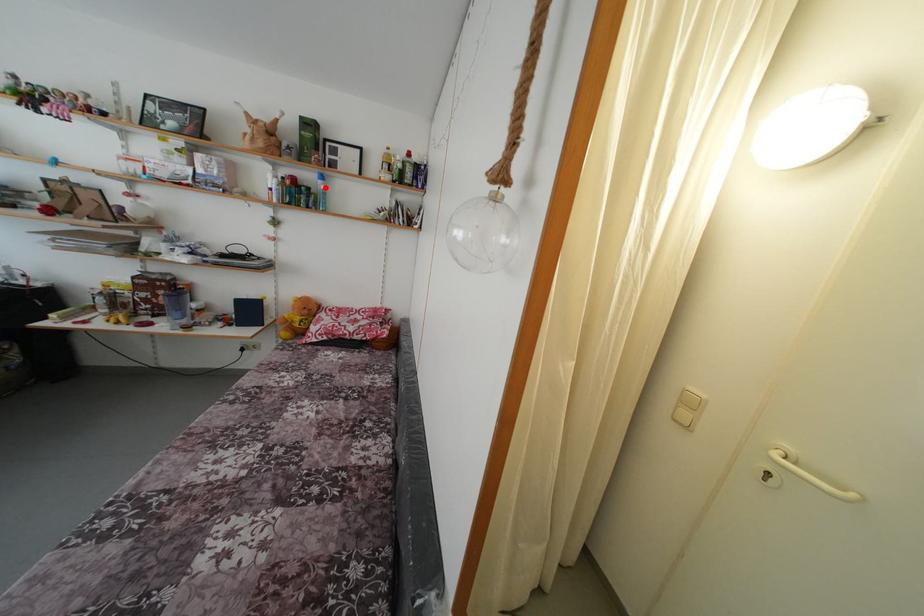
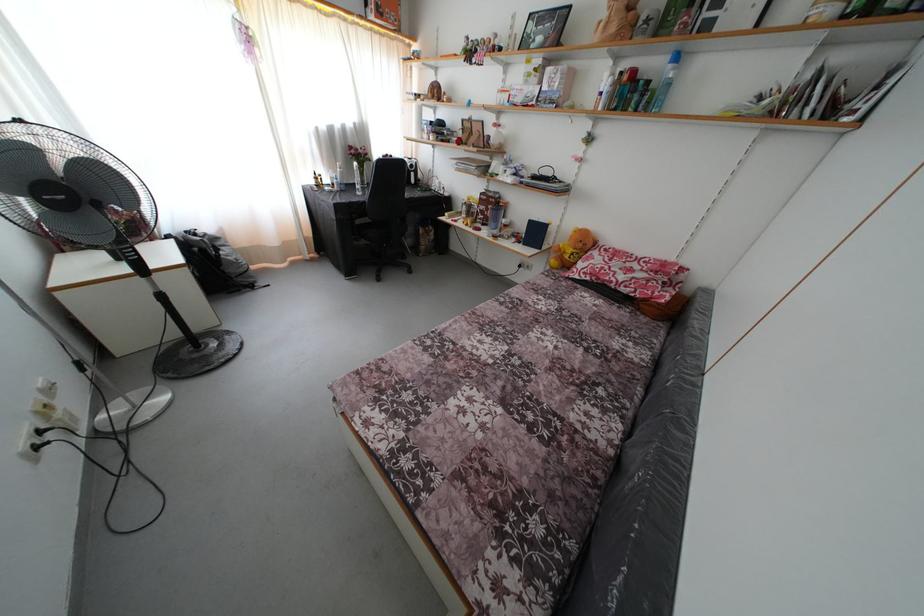
Where in the second image is the point corresponding to the highlighted location from the first image?

(675, 73)